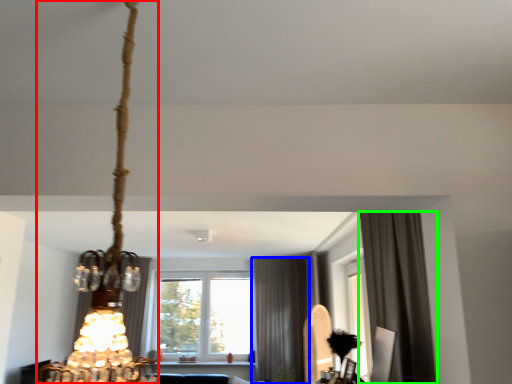
Question: Based on their relative distances, which object is nearer to lamp (highlighted by a red box)? Choose from curtain (highlighted by a blue box) and curtain (highlighted by a green box).

Choices:
 (A) curtain
 (B) curtain

Answer: (B)